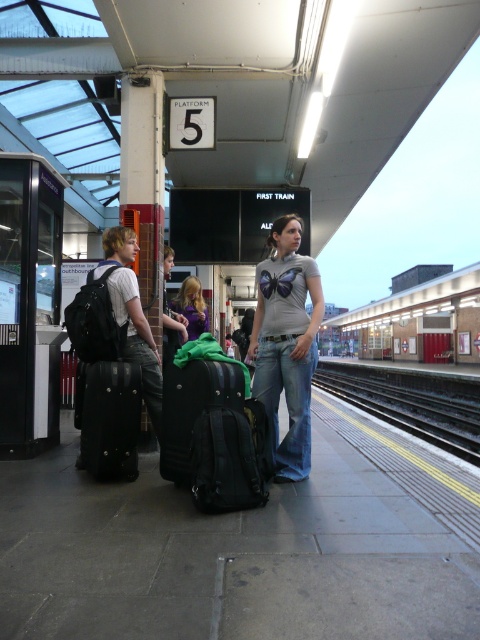
Question: Which object is positioned farthest from the metallic silver train at center?

Choices:
 (A) black metal train track at lower center
 (B) black fabric suitcase at center
 (C) matte gray t-shirt with butterfly design at center

Answer: (C)

Question: Which point appears farthest from the camera in this image?

Choices:
 (A) (203, 324)
 (B) (225, 480)

Answer: (A)

Question: Does matte gray t-shirt with butterfly design at center have a larger size compared to black textured suitcase at center?

Choices:
 (A) no
 (B) yes

Answer: (B)

Question: Does metallic silver train at center have a smaller size compared to black matte suitcase at left?

Choices:
 (A) yes
 (B) no

Answer: (B)

Question: Does matte gray t-shirt with butterfly design at center appear on the left side of black metal train track at lower center?

Choices:
 (A) yes
 (B) no

Answer: (A)

Question: Which point is closer to the camera?

Choices:
 (A) (169, 394)
 (B) (112, 369)

Answer: (A)